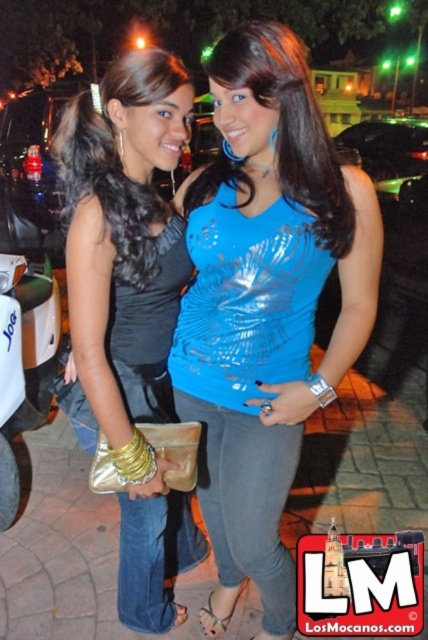
Looking at this image, is shiny blue tank top at center taller than shiny blue top at center?

Correct, shiny blue tank top at center is much taller as shiny blue top at center.

Can you confirm if shiny blue tank top at center is shorter than shiny blue top at center?

No.

Who is more distant from viewer, [296,317] or [314,164]?

Positioned behind is point [296,317].

Locate an element on the screen. The width and height of the screenshot is (428, 640). shiny blue tank top at center is located at coordinates (265, 305).

Which is more to the left, shiny blue top at center or white matte scooter at lower left?

white matte scooter at lower left

At what (x,y) coordinates should I click in order to perform the action: click on shiny blue top at center. Please return your answer as a coordinate pair (x, y). Looking at the image, I should click on (290, 122).

What do you see at coordinates (290, 122) in the screenshot?
I see `shiny blue top at center` at bounding box center [290, 122].

I want to click on shiny blue top at center, so click(290, 122).

This screenshot has width=428, height=640. What do you see at coordinates (265, 305) in the screenshot?
I see `shiny blue tank top at center` at bounding box center [265, 305].

Is shiny blue tank top at center wider than white matte scooter at lower left?

Indeed, shiny blue tank top at center has a greater width compared to white matte scooter at lower left.

Who is more distant from viewer, (183, 358) or (8, 419)?

The point (8, 419) is behind.

Locate an element on the screen. Image resolution: width=428 pixels, height=640 pixels. shiny blue tank top at center is located at coordinates pyautogui.click(x=265, y=305).